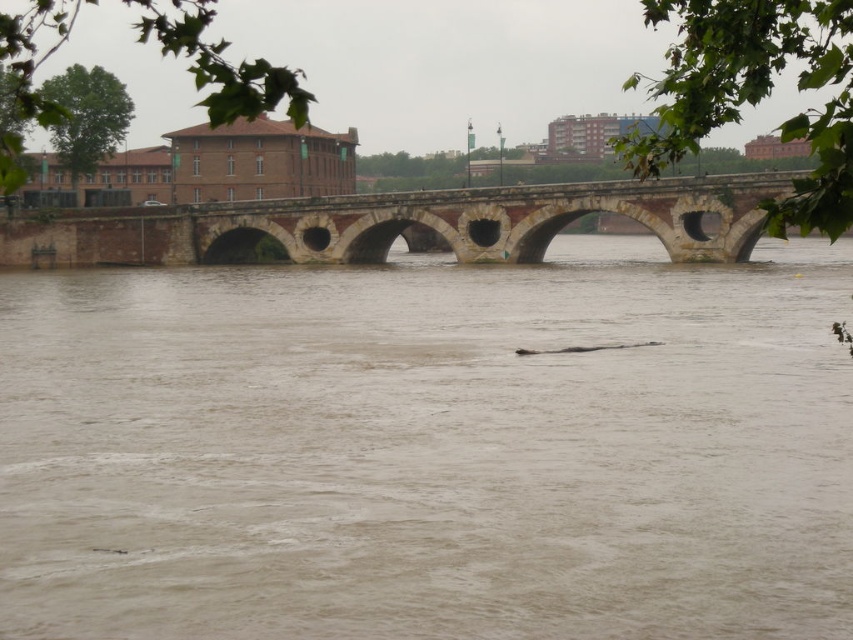
You are a boat captain trying to navigate through the flooded river. You see the brown muddy water at center and the brown stone bridge at center. Which one is wider from your perspective?

The brown muddy water at center is wider than the brown stone bridge at center according to the description.

You are standing on the historic stone bridge and looking down at the flooded river. There is a point marked at coordinates (428, 449). What is located at this point?

The point at coordinates (428, 449) corresponds to brown muddy water at center.